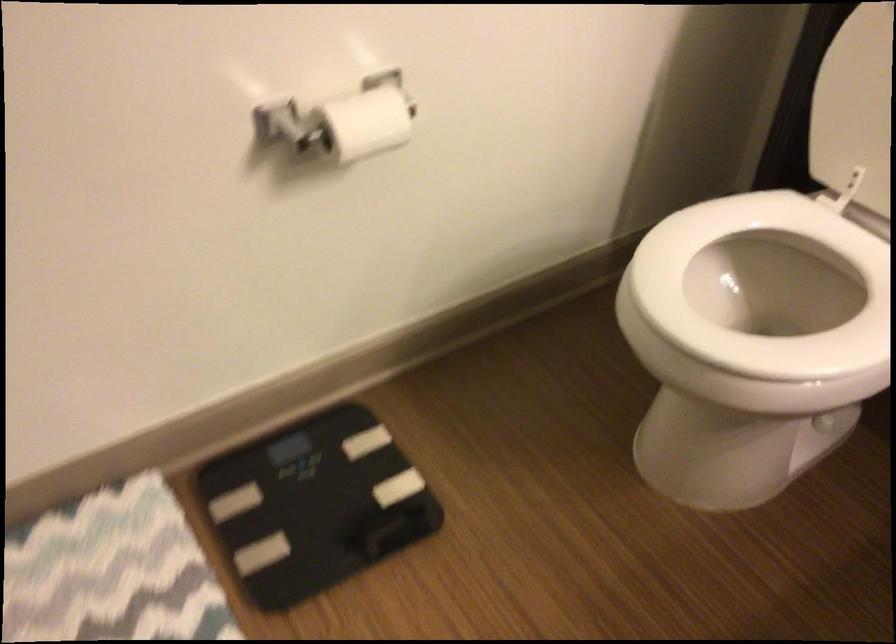
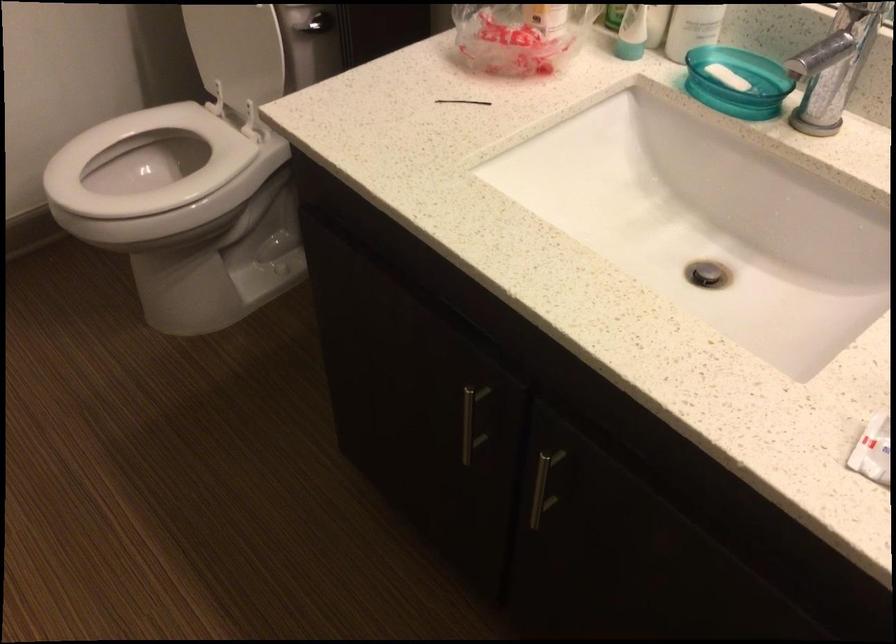
In the second image, find the point that corresponds to the point at 702,266 in the first image.

(144, 163)